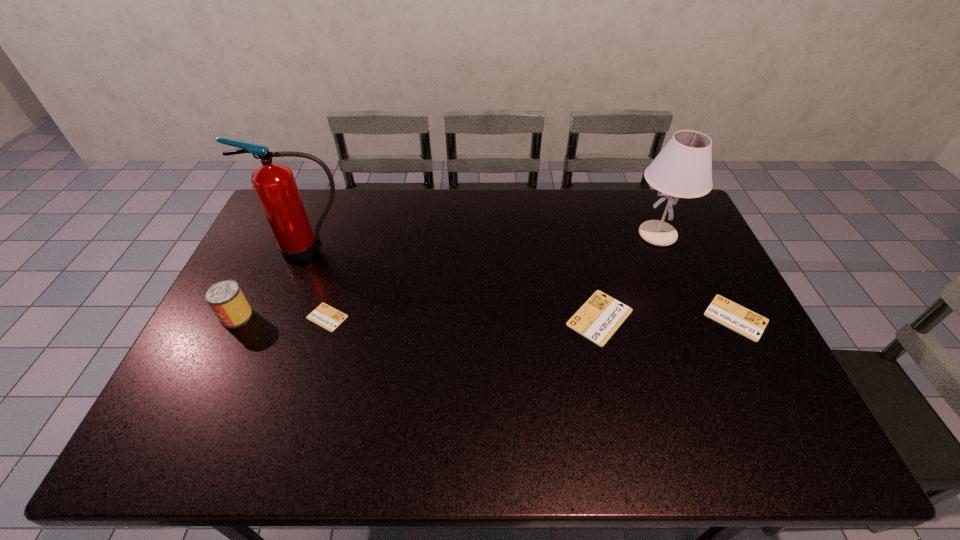
To ensure equal spacing by inserting another identity_card among them, please point out a vacant spot for this new identity_card. Please provide its 2D coordinates. Your answer should be formatted as a tuple, i.e. [(x, y)], where the tuple contains the x and y coordinates of a point satisfying the conditions above.

[(464, 318)]